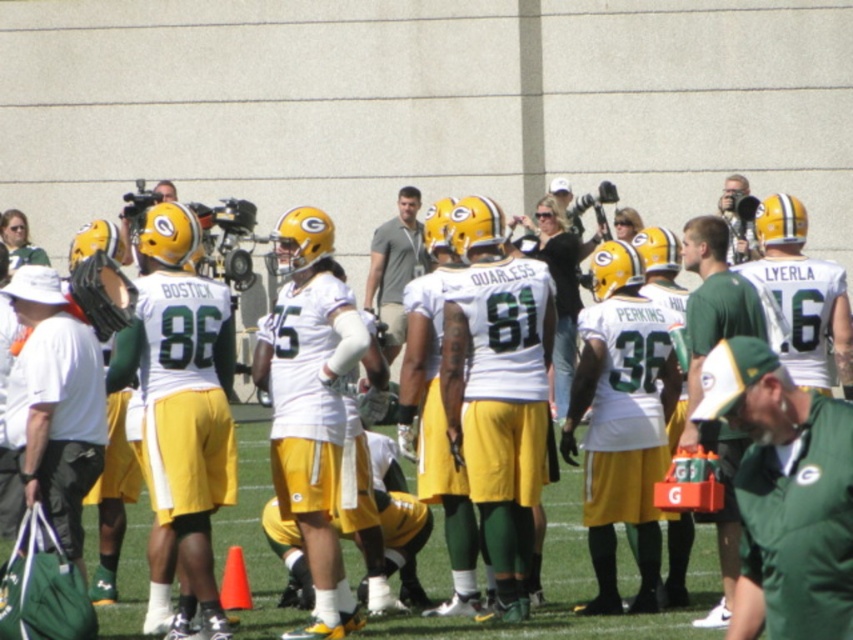
Between green matte helmet at center and metallic silver camera at upper right, which one appears on the right side from the viewer's perspective?

metallic silver camera at upper right is more to the right.

Who is positioned more to the left, green matte helmet at center or metallic silver camera at upper right?

green matte helmet at center

Which is in front, point (727, 516) or point (734, 237)?

Point (727, 516)

The height and width of the screenshot is (640, 853). I want to click on green matte helmet at center, so click(x=699, y=378).

Image resolution: width=853 pixels, height=640 pixels. In order to click on white matte jersey at center in this screenshot , I will do `click(573, 589)`.

Between point (258, 456) and point (393, 218), which one is positioned in front?

Point (258, 456) is in front.

Which is behind, point (618, 628) or point (409, 241)?

Positioned behind is point (409, 241).

Locate an element on the screen. This screenshot has width=853, height=640. white matte jersey at center is located at coordinates (573, 589).

From the picture: Does green matte cap at center have a smaller size compared to white matte jersey at center?

Indeed, green matte cap at center has a smaller size compared to white matte jersey at center.

Which is behind, point (763, 376) or point (271, 596)?

The point (271, 596) is behind.

You are a GUI agent. You are given a task and a screenshot of the screen. Output one action in this format:
    pyautogui.click(x=<x>, y=<y>)
    Task: Click on the green matte cap at center
    This screenshot has height=640, width=853.
    Given the screenshot: What is the action you would take?
    pyautogui.click(x=785, y=493)